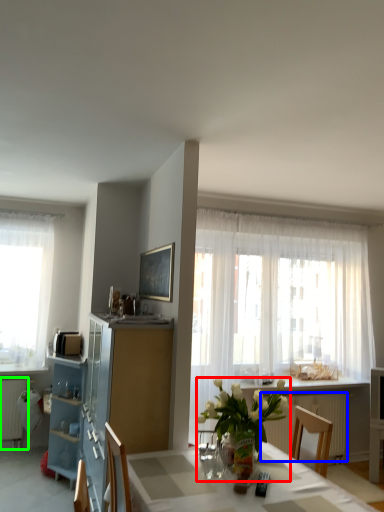
Question: Which is nearer to the houseplant (highlighted by a red box)? radiator (highlighted by a blue box) or radiator (highlighted by a green box).

Choices:
 (A) radiator
 (B) radiator

Answer: (A)